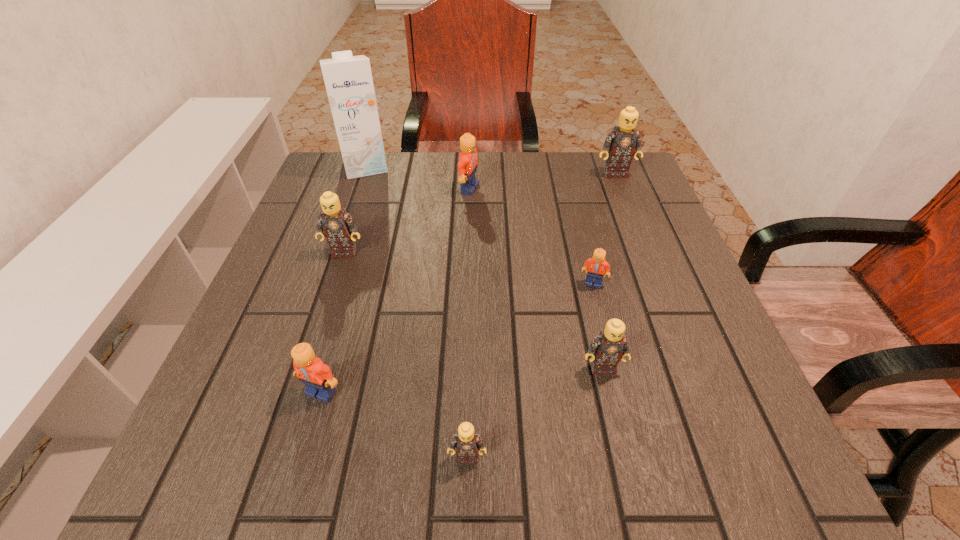
Locate an element on the screen. This screenshot has height=540, width=960. vacant space located in front of the third nearest Lego is located at coordinates (612, 414).

Where is `free region located on the front-facing side of the fourth nearest object`? Image resolution: width=960 pixels, height=540 pixels. free region located on the front-facing side of the fourth nearest object is located at coordinates (622, 399).

Identify the location of carton that is at the far edge. The width and height of the screenshot is (960, 540). (348, 79).

Find the location of a particular element. object situated at the near edge is located at coordinates (467, 442).

Find the location of a particular element. carton located in the left edge section of the desktop is located at coordinates (348, 79).

Locate an element on the screen. This screenshot has width=960, height=540. object that is at the right edge is located at coordinates (621, 143).

You are a GUI agent. You are given a task and a screenshot of the screen. Output one action in this format:
    pyautogui.click(x=<x>, y=<y>)
    Task: Click on the object that is at the far left corner
    The height and width of the screenshot is (540, 960).
    Given the screenshot: What is the action you would take?
    pyautogui.click(x=348, y=79)

Locate an element on the screen. The image size is (960, 540). object present at the far right corner is located at coordinates tap(621, 143).

Find the location of a particular element. The image size is (960, 540). vacant region at the far edge of the desktop is located at coordinates (391, 158).

In the image, there is a desktop. At what (x,y) coordinates should I click in order to perform the action: click on vacant space at the left edge. Please return your answer as a coordinate pair (x, y). Looking at the image, I should click on (292, 296).